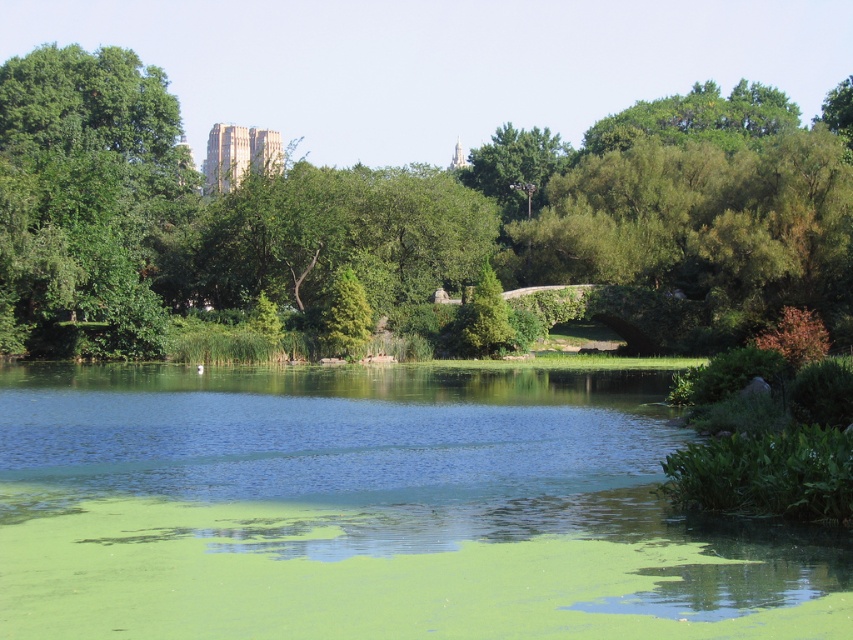
Question: Which of these objects is positioned closest to the green algae-covered water at center?

Choices:
 (A) green leafy tree at upper left
 (B) green leafy tree at center

Answer: (A)

Question: Among these points, which one is nearest to the camera?

Choices:
 (A) (190, 198)
 (B) (825, 596)

Answer: (B)

Question: Does green algae-covered water at center lie in front of green leafy tree at center?

Choices:
 (A) yes
 (B) no

Answer: (A)

Question: Which point is farther to the camera?

Choices:
 (A) green leafy tree at center
 (B) green algae-covered water at center
 (C) green leafy tree at upper left

Answer: (A)

Question: Where is green algae-covered water at center located in relation to green leafy tree at center in the image?

Choices:
 (A) left
 (B) right

Answer: (A)

Question: Can you confirm if green algae-covered water at center is positioned above green leafy tree at center?

Choices:
 (A) yes
 (B) no

Answer: (B)